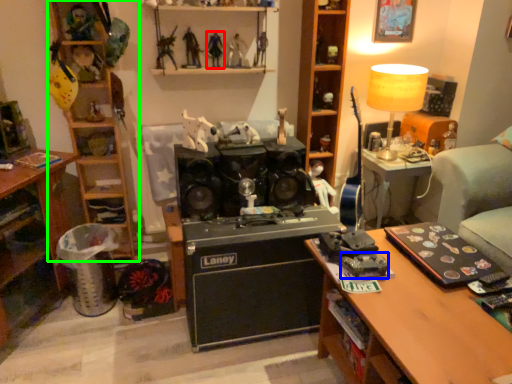
Question: Which object is positioned closest to toy (highlighted by a red box)? Select from toy (highlighted by a blue box) and shelf (highlighted by a green box).

Choices:
 (A) toy
 (B) shelf

Answer: (B)